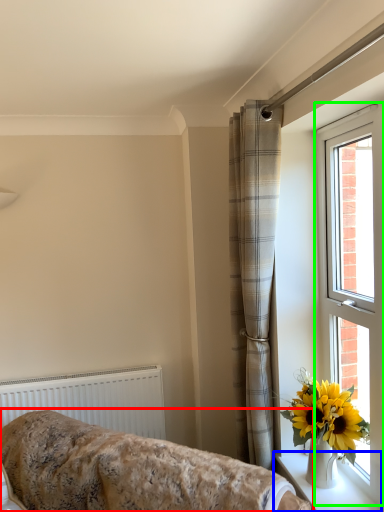
Question: Considering the real-world distances, which object is farthest from furniture (highlighted by a red box)? window sill (highlighted by a blue box) or window (highlighted by a green box)?

Choices:
 (A) window sill
 (B) window

Answer: (B)